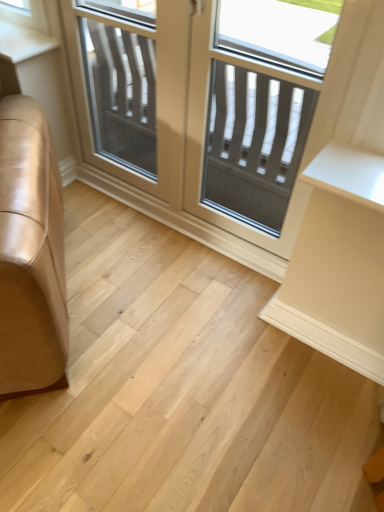
Locate an element on the screen. This screenshot has width=384, height=512. free point above natural wood floor at lower left (from a real-world perspective) is located at coordinates (173, 349).